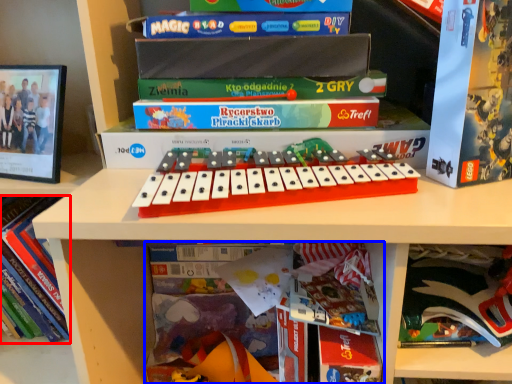
Question: Which point is closer to the camera, book (highlighted by a red box) or book (highlighted by a blue box)?

Choices:
 (A) book
 (B) book

Answer: (B)